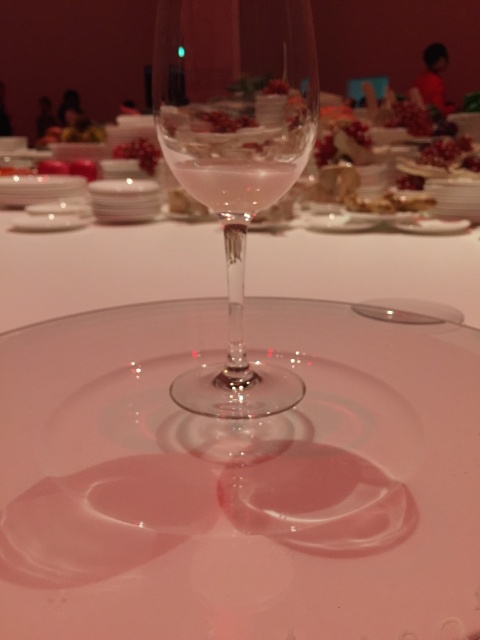
Question: Among these objects, which one is farthest from the camera?

Choices:
 (A) transparent glass at center
 (B) clear glass wine glass at center

Answer: (A)

Question: Does transparent glass at center have a greater width compared to clear glass wine at center?

Choices:
 (A) no
 (B) yes

Answer: (B)

Question: Is transparent glass at center behind clear glass wine at center?

Choices:
 (A) no
 (B) yes

Answer: (B)

Question: Which object is closer to the camera taking this photo?

Choices:
 (A) smooth brown pastry at center
 (B) clear glass wine glass at center
 (C) pomegranate seeds at center
 (D) transparent glass at center

Answer: (C)

Question: Based on their relative distances, which object is farther from the pomegranate seeds at center?

Choices:
 (A) clear glass wine at center
 (B) clear glass wine glass at center

Answer: (B)

Question: Is clear glass wine glass at center to the left of pomegranate seeds at center from the viewer's perspective?

Choices:
 (A) yes
 (B) no

Answer: (B)